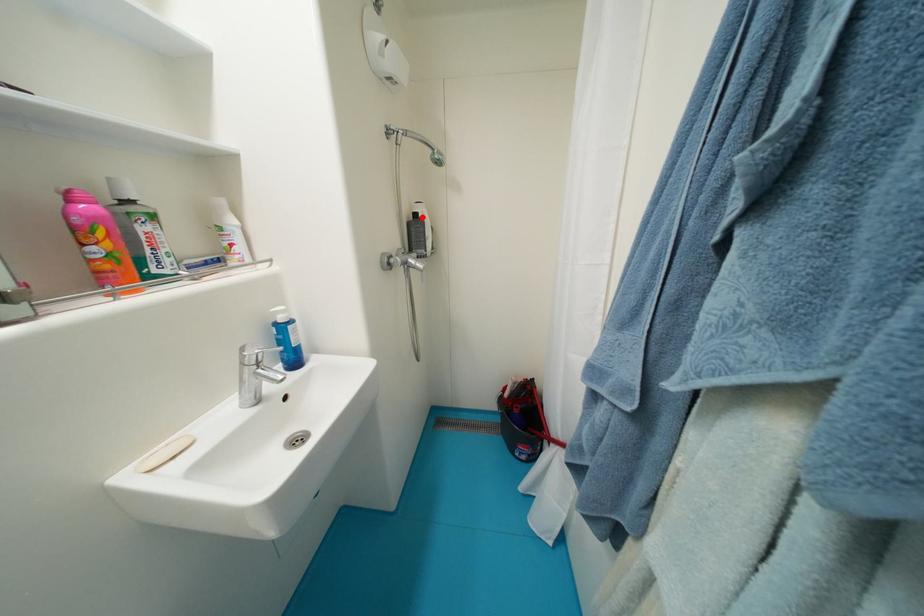
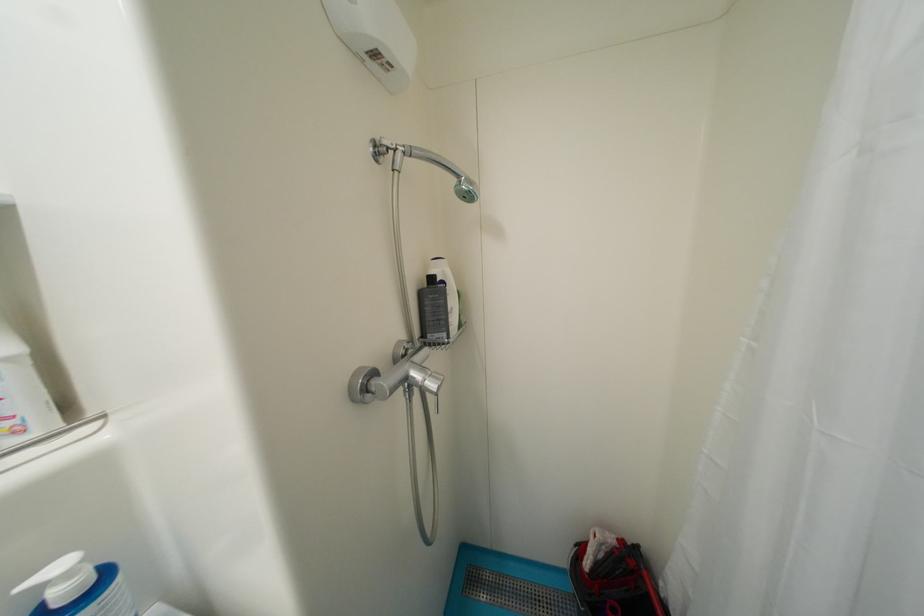
Find the pixel in the second image that matches the highlighted location in the first image.

(439, 281)